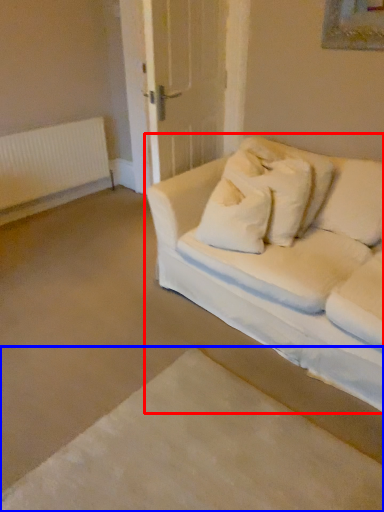
Question: Among these objects, which one is farthest to the camera, studio couch (highlighted by a red box) or bed frame (highlighted by a blue box)?

Choices:
 (A) studio couch
 (B) bed frame

Answer: (A)